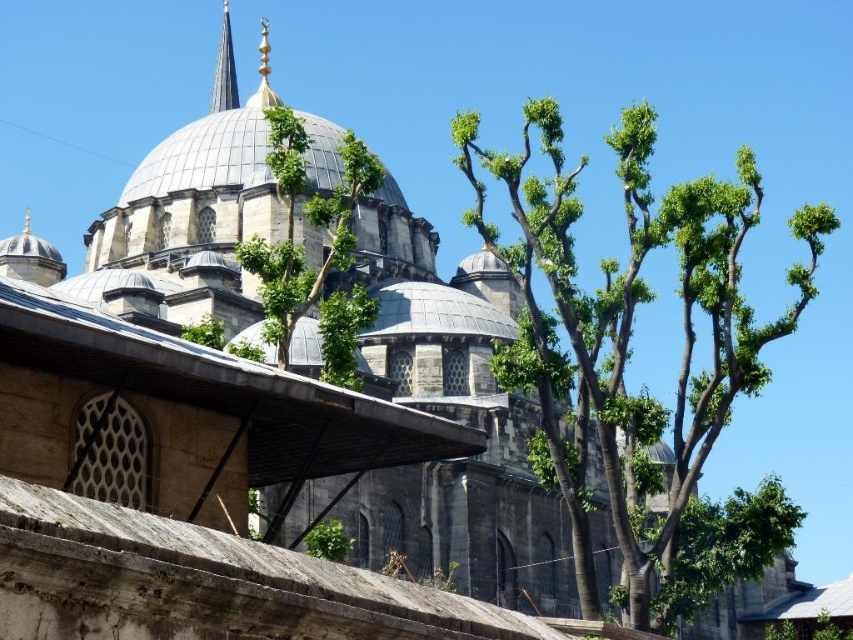
Can you confirm if green leafy tree at center is smaller than shiny silver spire at upper center?

Incorrect, green leafy tree at center is not smaller in size than shiny silver spire at upper center.

Identify the location of green leafy tree at center. (630, 342).

Locate an element on the screen. green leafy tree at center is located at coordinates (x=630, y=342).